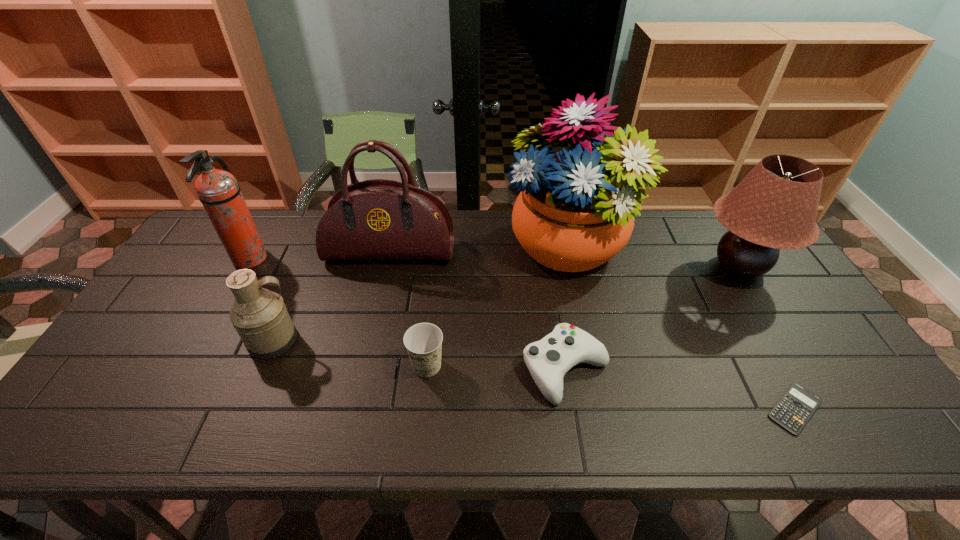
The height and width of the screenshot is (540, 960). I want to click on vacant space located 0.250m on the front-facing side of the handbag, so click(372, 333).

Locate an element on the screen. The width and height of the screenshot is (960, 540). free space located 0.200m on the front-facing side of the lampshade is located at coordinates (630, 267).

Where is `free space located 0.340m on the front-facing side of the lampshade`? The width and height of the screenshot is (960, 540). free space located 0.340m on the front-facing side of the lampshade is located at coordinates (585, 267).

This screenshot has width=960, height=540. I want to click on free space located 0.100m on the front-facing side of the lampshade, so point(662,267).

At what (x,y) coordinates should I click in order to perform the action: click on vacant space located 0.120m on the right of the fifth tallest object. Please return your answer as a coordinate pair (x, y). This screenshot has height=540, width=960. Looking at the image, I should click on (345, 340).

Locate an element on the screen. The height and width of the screenshot is (540, 960). vacant space positioned on the right of the sixth tallest object is located at coordinates (534, 366).

Where is `vacant point located on the left of the control`? The width and height of the screenshot is (960, 540). vacant point located on the left of the control is located at coordinates (502, 369).

Locate an element on the screen. Image resolution: width=960 pixels, height=540 pixels. vacant space situated on the back of the shortest object is located at coordinates pos(727,288).

The height and width of the screenshot is (540, 960). Find the location of `flower arrangement that is at the far edge`. flower arrangement that is at the far edge is located at coordinates (575, 210).

I want to click on fire extinguisher positioned at the far edge, so click(218, 191).